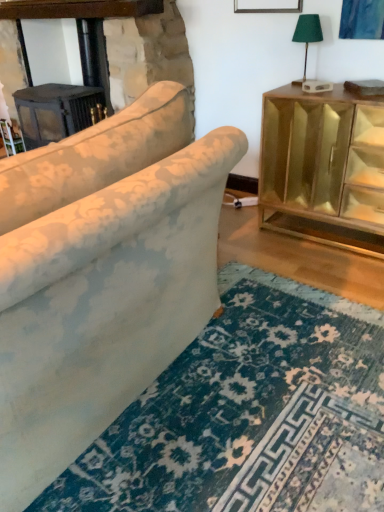
Locate an element on the screen. The height and width of the screenshot is (512, 384). free point below gold mirrored cabinet at right (from a real-world perspective) is located at coordinates pyautogui.click(x=312, y=232).